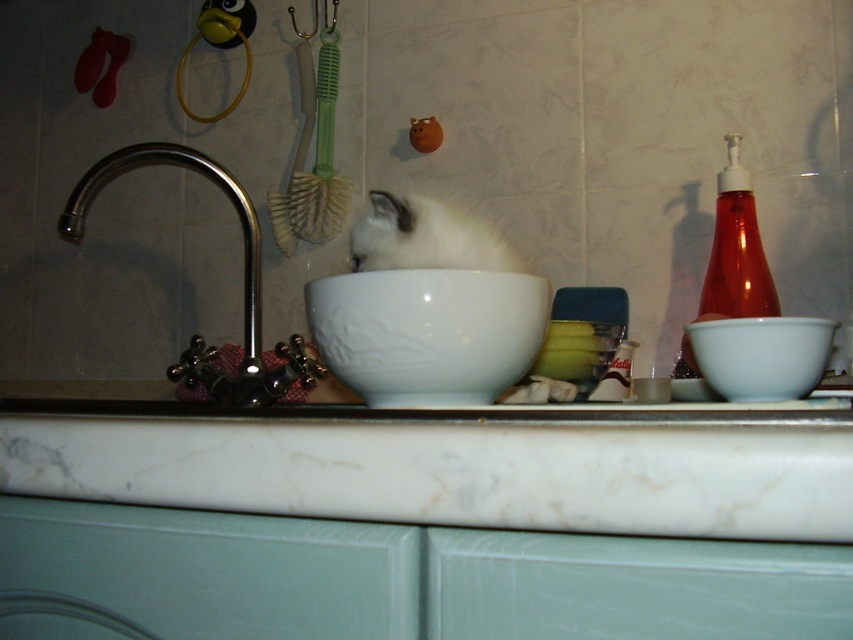
You are a cat that wants to drink water from the white glossy bowl at center. The polished chrome faucet at left is nearby. Since you are short, which object do you need to approach to drink water without jumping?

The white glossy bowl at center has a lesser height compared to the polished chrome faucet at left, so the cat should approach the white glossy bowl at center to drink water without jumping.

You are a cat owner who wants to ensure your cat can easily reach its bowl. Given the white marble counter at center and the white glossy bowl at right, which object is shorter and might require adjusting the bowl height?

The white marble counter at center is shorter than the white glossy bowl at right, so the bowl might already be at an appropriate height, but if the cat has difficulty reaching, you could consider raising the bowl slightly.